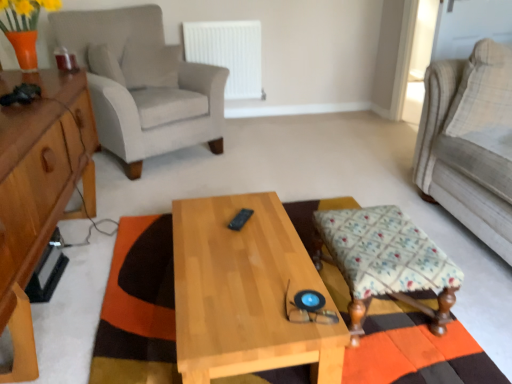
Question: Considering the positions of light gray fabric armchair at left and fluffy beige pillow at right in the image, is light gray fabric armchair at left bigger or smaller than fluffy beige pillow at right?

Choices:
 (A) big
 (B) small

Answer: (A)

Question: Visually, is light gray fabric armchair at left positioned to the left or to the right of fluffy beige pillow at right?

Choices:
 (A) right
 (B) left

Answer: (B)

Question: Which object is the closest to the light wood/texture coffee table at center?

Choices:
 (A) fluffy beige pillow at right
 (B) light gray fabric armchair at left
 (C) light brown wood cabinet at left
 (D) light beige fabric couch at right
 (E) orange and brown woven mat at center

Answer: (E)

Question: Estimate the real-world distances between objects in this image. Which object is closer to the white plastic radiator at upper center?

Choices:
 (A) light beige fabric couch at right
 (B) orange and brown woven mat at center
 (C) floral fabric stool at lower right
 (D) fluffy beige pillow at right
 (E) light wood/texture coffee table at center

Answer: (A)